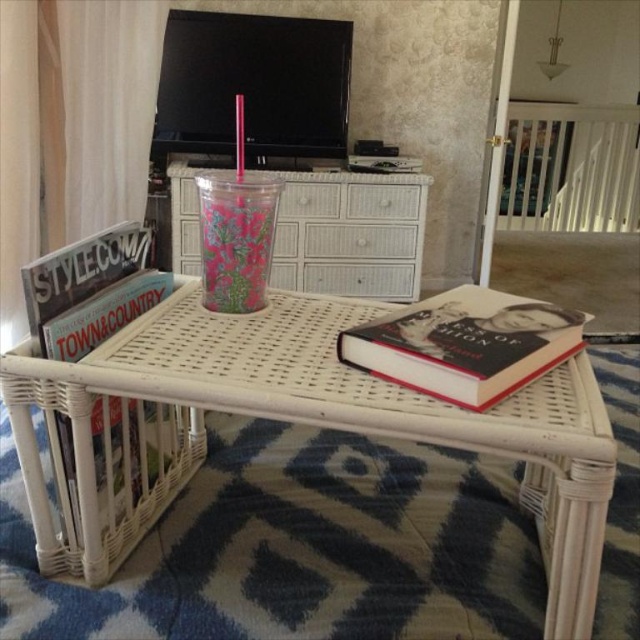
Is white wicker table at center to the left of translucent floral-patterned cup at center from the viewer's perspective?

Incorrect, white wicker table at center is not on the left side of translucent floral-patterned cup at center.

Identify the location of white wicker table at center. (x=355, y=413).

Is white wicker table at center behind matte black magazine at left?

No.

Between white wicker table at center and matte black magazine at left, which one is positioned higher?

matte black magazine at left is higher up.

Between point (560, 580) and point (67, 276), which one is positioned in front?

Point (560, 580) is in front.

Where is `white wicker table at center`? This screenshot has width=640, height=640. white wicker table at center is located at coordinates (355, 413).

From the picture: Is hardcover book at center smaller than translucent floral-patterned cup at center?

Incorrect, hardcover book at center is not smaller in size than translucent floral-patterned cup at center.

Can you confirm if hardcover book at center is shorter than translucent floral-patterned cup at center?

Correct, hardcover book at center is not as tall as translucent floral-patterned cup at center.

Where is `hardcover book at center`? This screenshot has width=640, height=640. hardcover book at center is located at coordinates (465, 344).